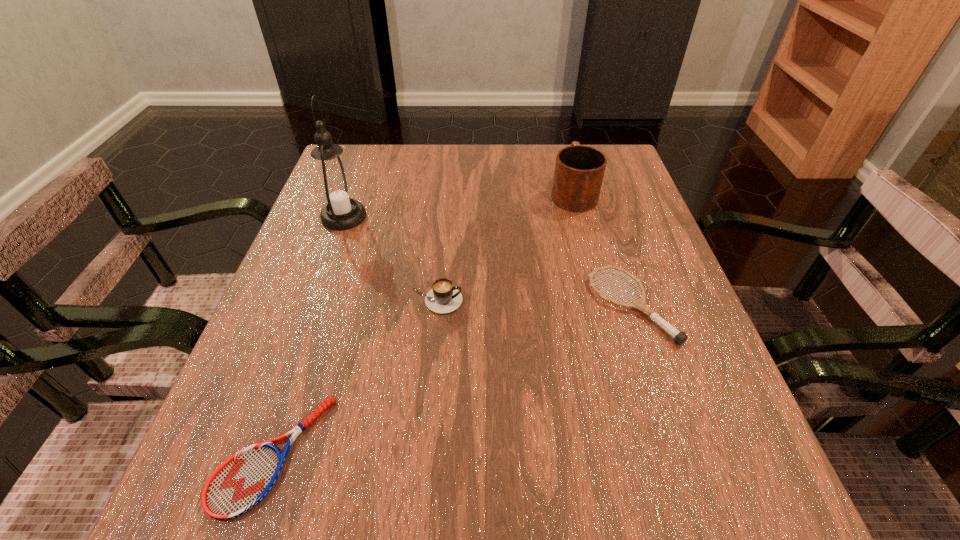
Identify the location of vacant space located 0.230m on the front of the fourth tallest object. (690, 488).

Find the location of a particular element. The width and height of the screenshot is (960, 540). vacant space positioned 0.300m on the right of the nearest object is located at coordinates (536, 454).

At what (x,y) coordinates should I click in order to perform the action: click on object located in the far edge section of the desktop. Please return your answer as a coordinate pair (x, y). Looking at the image, I should click on (579, 170).

Find the location of `object that is at the near edge`. object that is at the near edge is located at coordinates (243, 480).

The image size is (960, 540). Identify the location of oil lamp present at the left edge. (335, 186).

Where is `tennis racket present at the left edge`? tennis racket present at the left edge is located at coordinates tap(243, 480).

Image resolution: width=960 pixels, height=540 pixels. Find the location of `mug that is positioned at the right edge`. mug that is positioned at the right edge is located at coordinates (579, 170).

This screenshot has width=960, height=540. In order to click on tennis racket positioned at the right edge in this screenshot , I will do `click(679, 337)`.

Image resolution: width=960 pixels, height=540 pixels. Find the location of `object that is positioned at the near left corner`. object that is positioned at the near left corner is located at coordinates (243, 480).

Where is `object present at the far right corner`? object present at the far right corner is located at coordinates (579, 170).